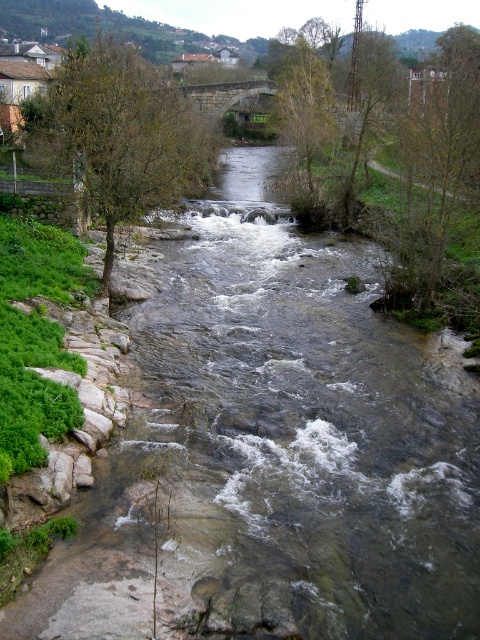
Based on the scene description, what does the point at coordinates (120, 132) indicate?

The point at coordinates (120, 132) marks the location of a green leafy tree on the left bank of the river.

You are an outdoor photographer planning to take a photo of both the green leafy tree at left and the green leafy tree at upper center. Which tree should you focus on first to ensure both are in sharp focus?

You should focus on the green leafy tree at left first because it is closer to the viewer than the green leafy tree at upper center. By focusing on the closer tree, the farther one will still be within the depth of field and appear sharp in the photo.

You are a hiker planning to cross the river using a narrow path that runs between the green leafy tree at upper right and the green leafy tree at upper center. The path is only wide enough for someone to pass if the trees are not too tall. Based on the scene, can you determine if the path is passable?

The green leafy tree at upper right is shorter than the green leafy tree at upper center. Since the path requires the trees not to be too tall, and the description only mentions the relative height between them without specifying exact measurements, it is unclear if their combined height or individual heights would obstruct the path. Therefore, it is uncertain whether the path is passable based solely on the provided information.